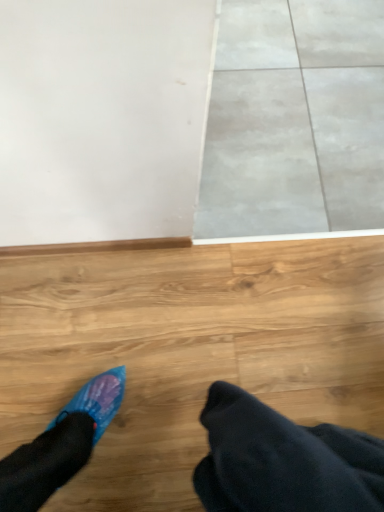
What do you see at coordinates (283, 461) in the screenshot?
I see `black fleece sweat pants at lower right` at bounding box center [283, 461].

In order to face black fleece sweat pants at lower right, should I rotate leftwards or rightwards?

Rotate right and turn 18.212 degrees.

You are a GUI agent. You are given a task and a screenshot of the screen. Output one action in this format:
    pyautogui.click(x=<x>, y=<y>)
    Task: Click on the black fleece sweat pants at lower right
    The height and width of the screenshot is (512, 384).
    Given the screenshot: What is the action you would take?
    pyautogui.click(x=283, y=461)

Where is `black fleece sweat pants at lower right`? black fleece sweat pants at lower right is located at coordinates (283, 461).